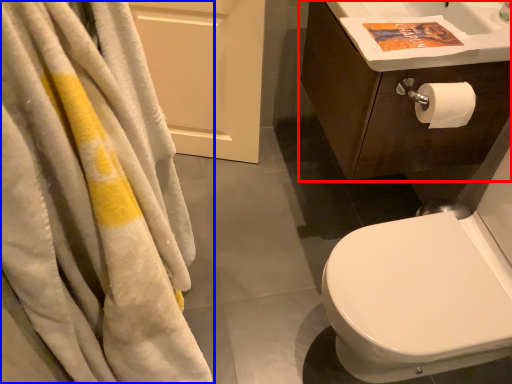
Question: Which object is further to the camera taking this photo, bathroom cabinet (highlighted by a red box) or towel (highlighted by a blue box)?

Choices:
 (A) bathroom cabinet
 (B) towel

Answer: (A)